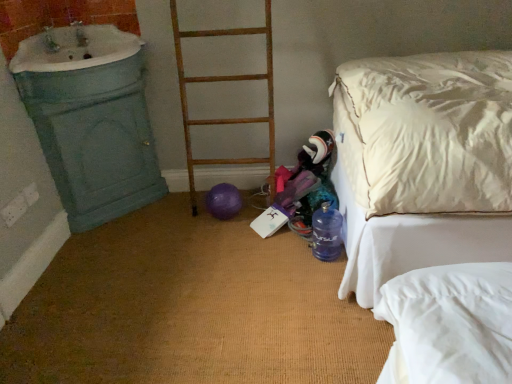
Question: Based on their sizes in the image, would you say rusty wood ladder at center is bigger or smaller than purple rubber balloon at center?

Choices:
 (A) small
 (B) big

Answer: (B)

Question: Relative to purple rubber balloon at center, is rusty wood ladder at center in front or behind?

Choices:
 (A) behind
 (B) front

Answer: (B)

Question: Estimate the real-world distances between objects in this image. Which object is closer to the rusty wood ladder at center?

Choices:
 (A) white porcelain sink at upper left
 (B) white satin bed at right
 (C) translucent blue bottle at lower right
 (D) purple rubber balloon at center

Answer: (D)

Question: Which object is positioned farthest from the translucent blue bottle at lower right?

Choices:
 (A) rusty wood ladder at center
 (B) white satin bed at right
 (C) white porcelain sink at upper left
 (D) purple rubber balloon at center

Answer: (C)